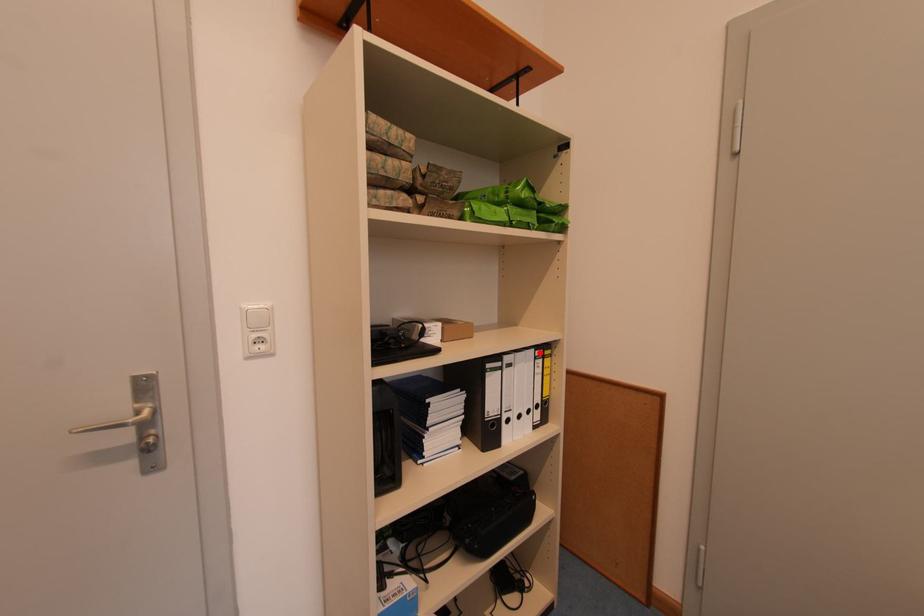
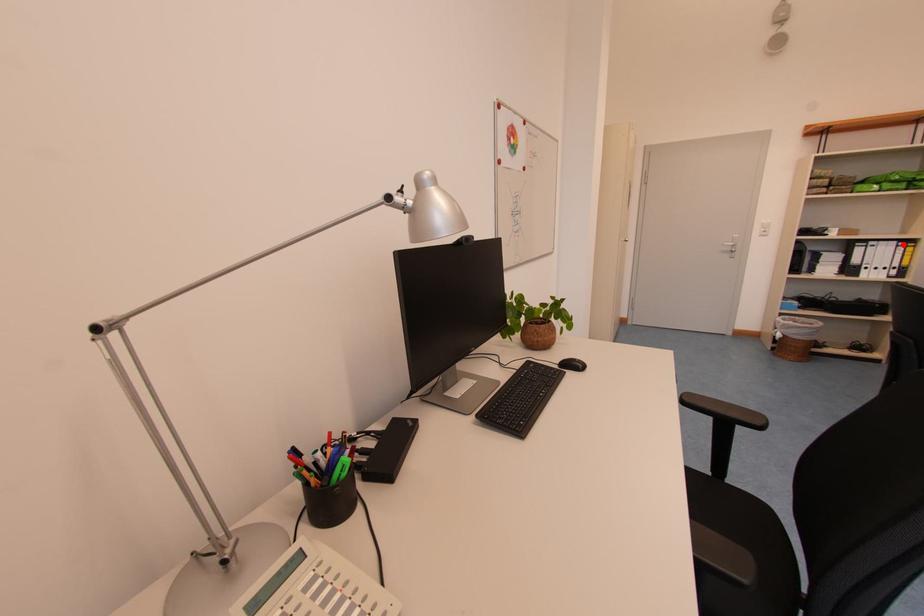
I am providing you with two images of the same scene from different viewpoints. A red point is marked on the first image and another point is marked on the second image. Do the highlighted points in image1 and image2 indicate the same real-world spot?

Yes